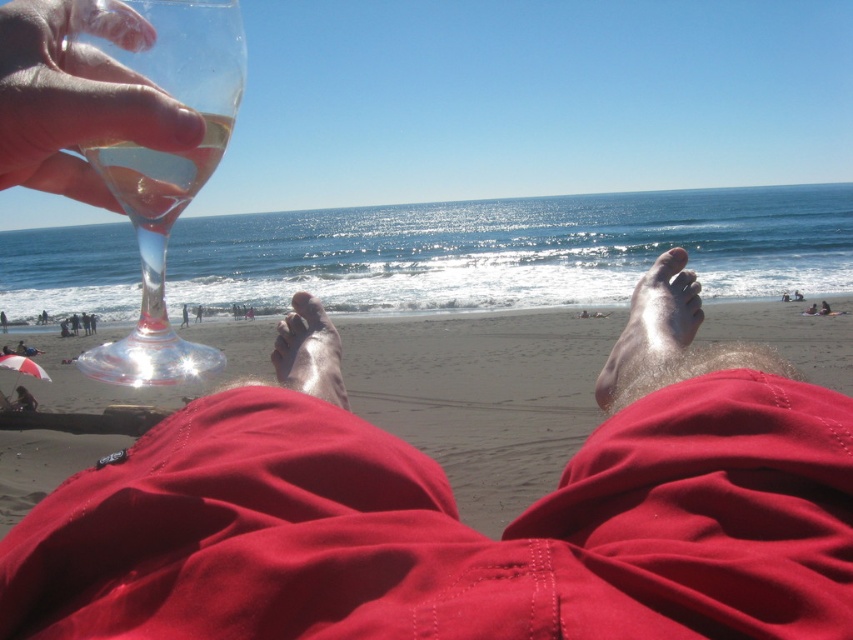
You are at the beach and holding two wine glasses, the matte glass wine glass at upper left and the transparent glass wine glass at upper left. Which one could potentially hold more liquid without spilling?

The matte glass wine glass at upper left might be wider than the transparent glass wine glass at upper left, so it could potentially hold more liquid without spilling if its width allows for a larger volume capacity.

You are standing on the beach and want to place a small seashell in your wine glass. The seashell is currently in your right hand. Which hand should you use to hold the matte glass wine glass at upper left to make this possible?

You should use your left hand to hold the matte glass wine glass at upper left because the description states that you are already holding the wine glass in your left hand.

You are lying on the beach and want to reach your wine glass. The glass is located at point (x=459, y=518). Given that your left hand is holding the glass, can you confirm if the glass is within your immediate reach?

The matte glass wine glass at upper left is represented by point (x=459, y=518). Since your left hand is holding the glass, it is already within your immediate reach.